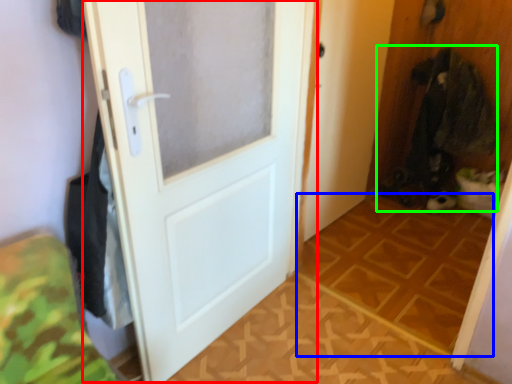
Question: Estimate the real-world distances between objects in this image. Which object is closer to door (highlighted by a red box), tile (highlighted by a blue box) or laundry (highlighted by a green box)?

Choices:
 (A) tile
 (B) laundry

Answer: (A)